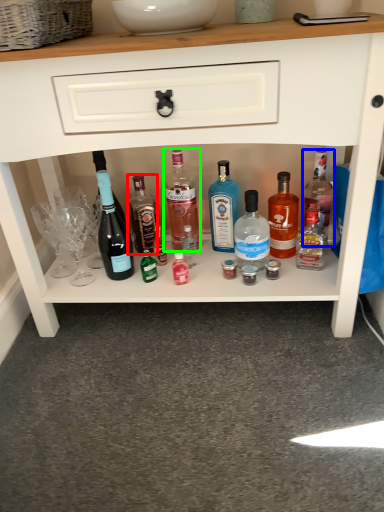
Question: Which is nearer to the bottle (highlighted by a red box)? bottle (highlighted by a blue box) or bottle (highlighted by a green box).

Choices:
 (A) bottle
 (B) bottle

Answer: (B)